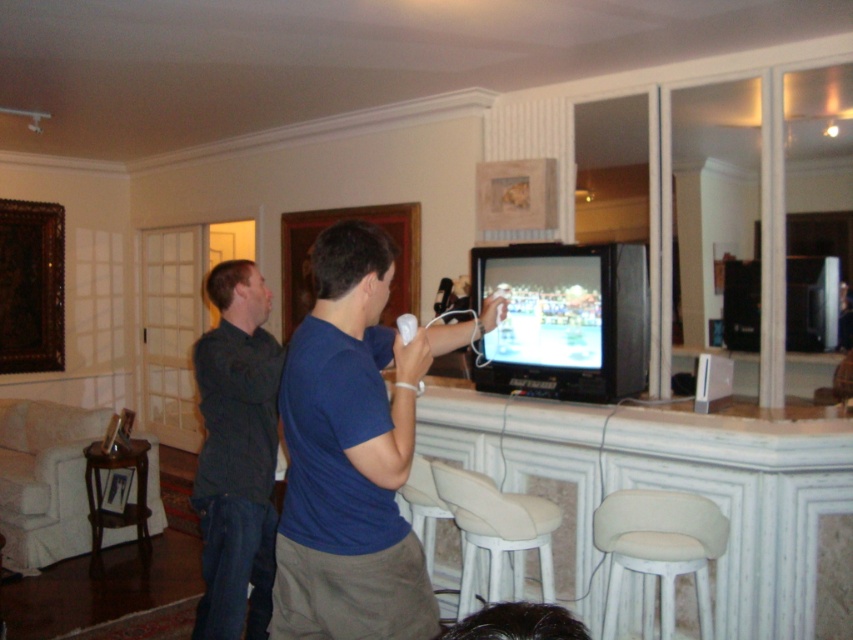
How far apart are blue cotton shirt at center and dark blue shirt at center?

They are 25.19 inches apart.

Who is more distant from viewer, [277,566] or [222,586]?

The point [222,586] is behind.

I want to click on blue cotton shirt at center, so click(352, 451).

Is beige fabric stool at lower center wider than brown wooden bar stool at lower left?

Indeed, beige fabric stool at lower center has a greater width compared to brown wooden bar stool at lower left.

Between beige fabric stool at lower center and brown wooden bar stool at lower left, which one is positioned lower?

brown wooden bar stool at lower left

Is point (489, 483) positioned behind point (90, 506)?

No.

Where is `beige fabric stool at lower center`? The height and width of the screenshot is (640, 853). beige fabric stool at lower center is located at coordinates (496, 531).

Between white fabric bar stool at lower right and white matte remote at center, which one has less height?

Standing shorter between the two is white matte remote at center.

Which is more to the left, white fabric bar stool at lower right or white matte remote at center?

white matte remote at center

Between point (697, 528) and point (397, 330), which one is positioned in front?

Point (697, 528) is more forward.

Find the location of `white fabric bar stool at lower right`. white fabric bar stool at lower right is located at coordinates (659, 550).